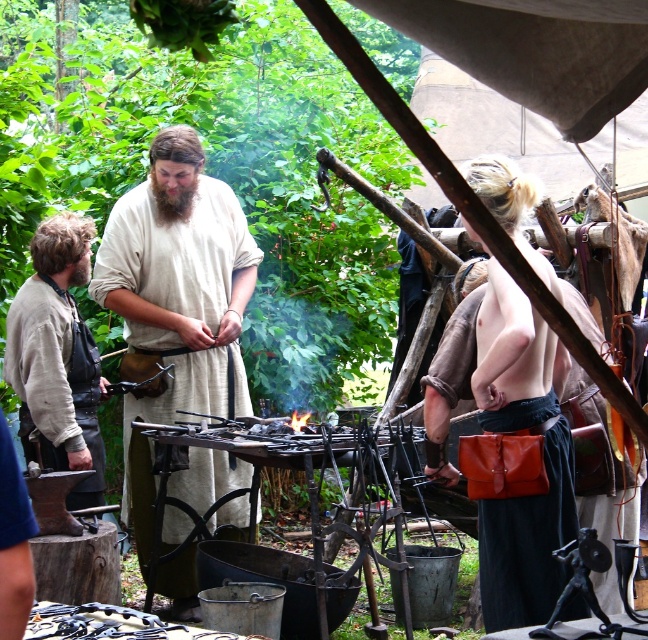
Does beige linen tunic at center have a lesser width compared to leather strap at center?

No, beige linen tunic at center is not thinner than leather strap at center.

Identify the location of beige linen tunic at center. (176, 301).

Is leather belt at lower center bigger than leather strap at center?

No.

Image resolution: width=648 pixels, height=640 pixels. Describe the element at coordinates (527, 541) in the screenshot. I see `leather belt at lower center` at that location.

At what (x,y) coordinates should I click in order to perform the action: click on leather belt at lower center. Please return your answer as a coordinate pair (x, y). Looking at the image, I should click on (527, 541).

Can you confirm if light beige fabric shirt at left is positioned to the left of leather strap at center?

Correct, you'll find light beige fabric shirt at left to the left of leather strap at center.

Does light beige fabric shirt at left appear on the right side of leather strap at center?

In fact, light beige fabric shirt at left is to the left of leather strap at center.

Which is in front, point (19, 364) or point (472, 605)?

Point (19, 364)

I want to click on light beige fabric shirt at left, so click(x=58, y=356).